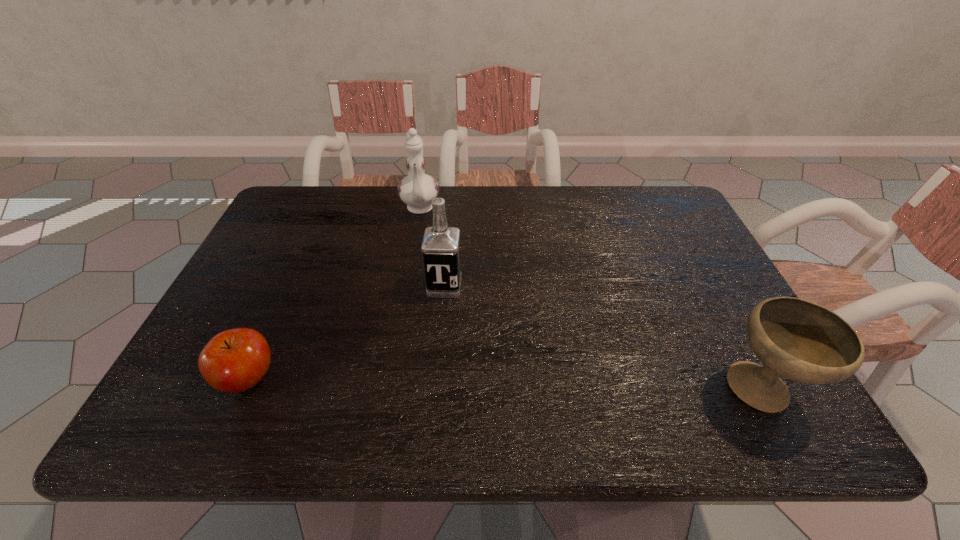
Image resolution: width=960 pixels, height=540 pixels. Find the location of `free space that satisfies the following two spatial constraints: 1. on the front side of the farthest object; 2. on the left side of the vodka`. free space that satisfies the following two spatial constraints: 1. on the front side of the farthest object; 2. on the left side of the vodka is located at coordinates (406, 286).